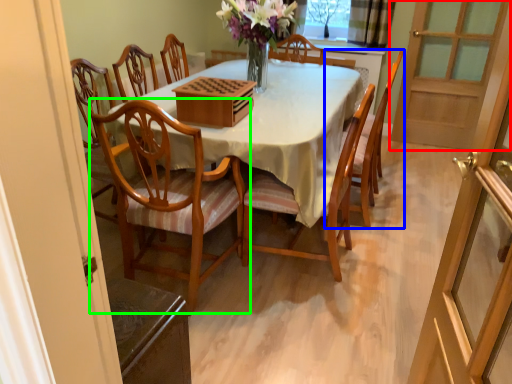
Question: Which object is positioned closest to screen door (highlighted by a red box)? Select from chair (highlighted by a blue box) and chair (highlighted by a green box).

Choices:
 (A) chair
 (B) chair

Answer: (A)